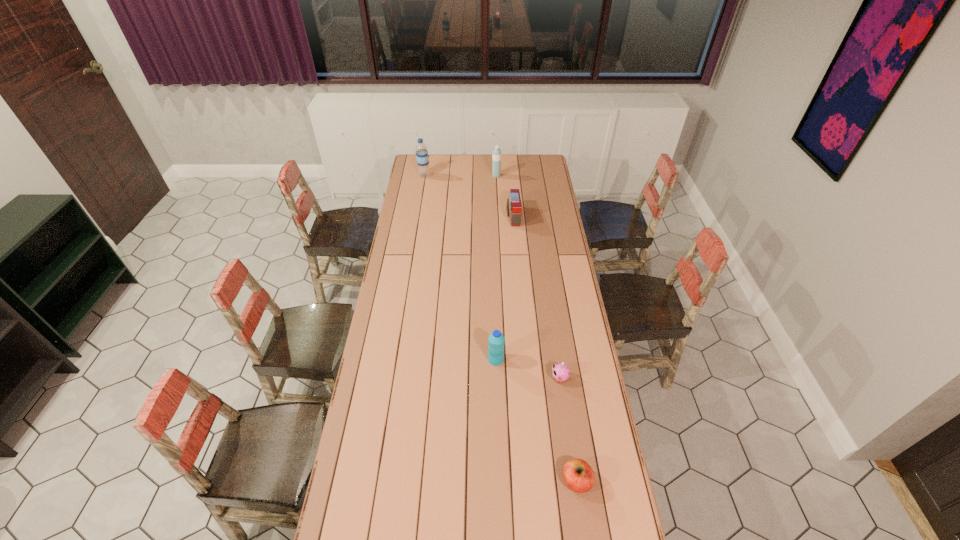
Identify which object is the fourth nearest to the second nearest object. Please provide its 2D coordinates. Your answer should be formatted as a tuple, i.e. [(x, y)], where the tuple contains the x and y coordinates of a point satisfying the conditions above.

[(496, 154)]

Where is `water bottle that is the closest to the fourth shortest object`? This screenshot has height=540, width=960. water bottle that is the closest to the fourth shortest object is located at coordinates (496, 154).

The height and width of the screenshot is (540, 960). In order to click on water bottle that is the closest to the nearest object in this screenshot , I will do `click(496, 340)`.

Where is `vacant area in the image that satisfies the following two spatial constraints: 1. on the label of the tallest object; 2. on the left side of the nearest object`? The height and width of the screenshot is (540, 960). vacant area in the image that satisfies the following two spatial constraints: 1. on the label of the tallest object; 2. on the left side of the nearest object is located at coordinates (374, 481).

Locate an element on the screen. This screenshot has width=960, height=540. vacant region that satisfies the following two spatial constraints: 1. on the front-facing side of the third shortest object; 2. on the front side of the third nearest object is located at coordinates (525, 360).

You are a GUI agent. You are given a task and a screenshot of the screen. Output one action in this format:
    pyautogui.click(x=<x>, y=<y>)
    Task: Click on the free spot that satisfies the following two spatial constraints: 1. on the label of the leftmost water bottle; 2. on the back side of the third tallest object
    The image size is (960, 540).
    Given the screenshot: What is the action you would take?
    pyautogui.click(x=394, y=360)